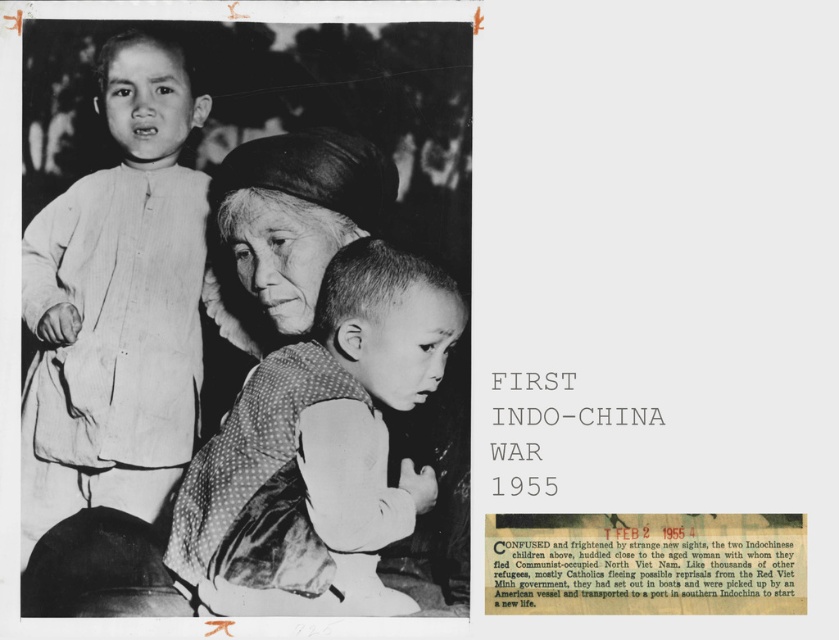
Can you confirm if light-colored fabric child at upper left is positioned to the right of polka dot fabric baby at center?

No, light-colored fabric child at upper left is not to the right of polka dot fabric baby at center.

Which of these two, light-colored fabric child at upper left or polka dot fabric baby at center, stands shorter?

Standing shorter between the two is polka dot fabric baby at center.

Where is `light-colored fabric child at upper left`? light-colored fabric child at upper left is located at coordinates (117, 304).